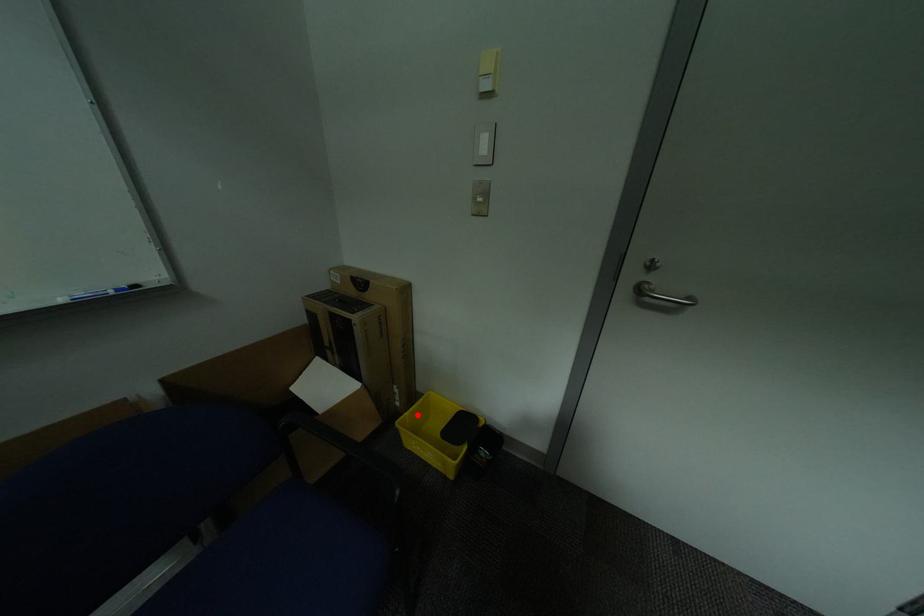
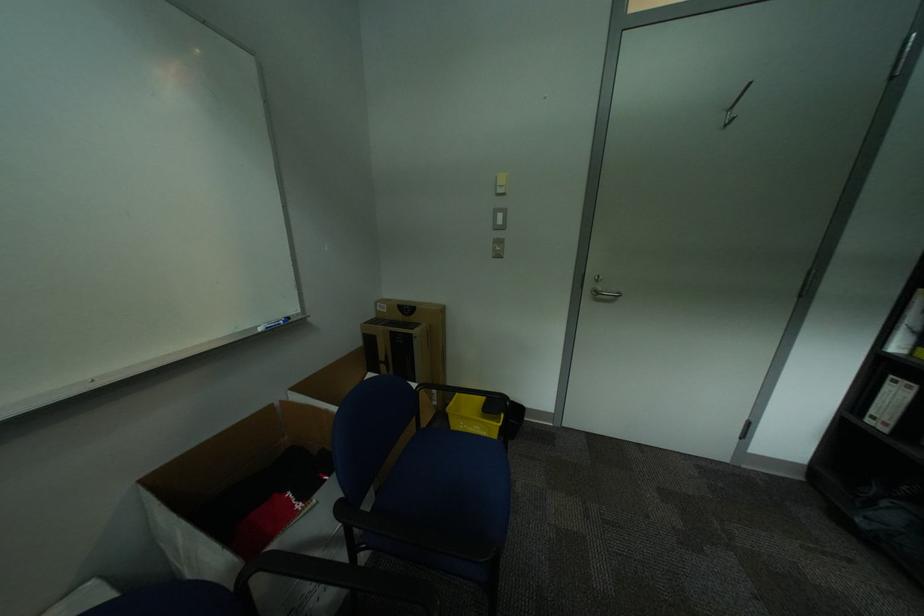
In the second image, find the point that corresponds to the highlighted location in the first image.

(463, 405)